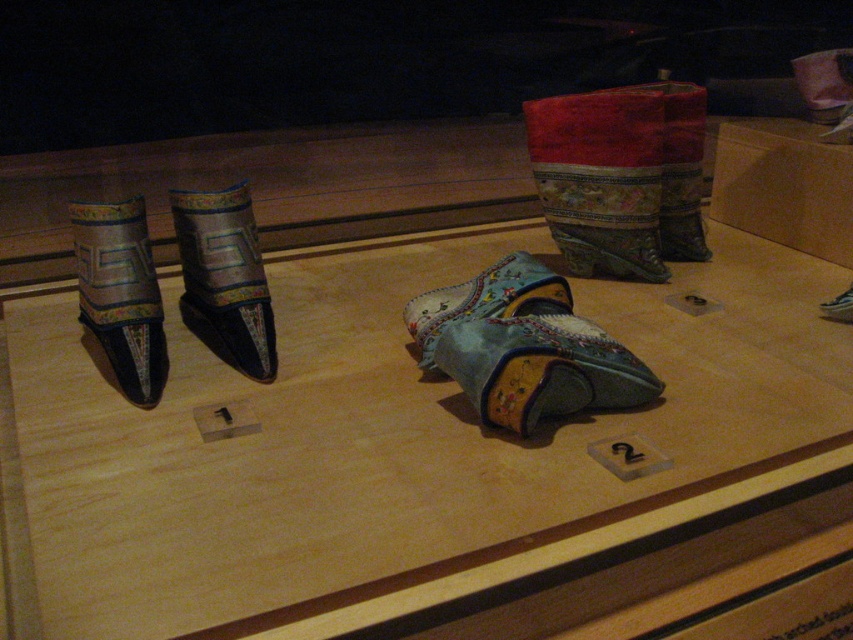
In the scene shown: You are a museum curator arranging an exhibit. You need to place a new item between the matte blue fabric shoes at center and the metallic pointed shoes on the left. Which direction should you place the new item relative to the metallic pointed shoes on the left?

The new item should be placed to the right of the metallic pointed shoes on the left since the matte blue fabric shoes at center are located to the right of them.